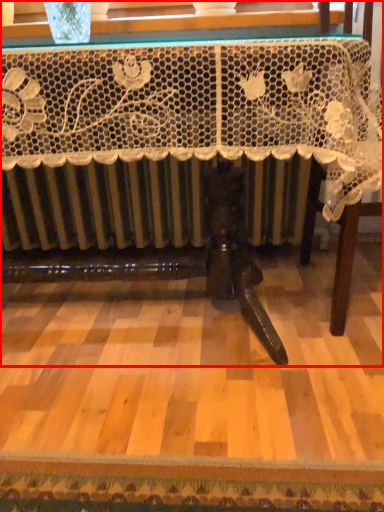
Question: Observing the image, what is the correct spatial positioning of table (annotated by the red box) in reference to furniture?

Choices:
 (A) right
 (B) left

Answer: (B)